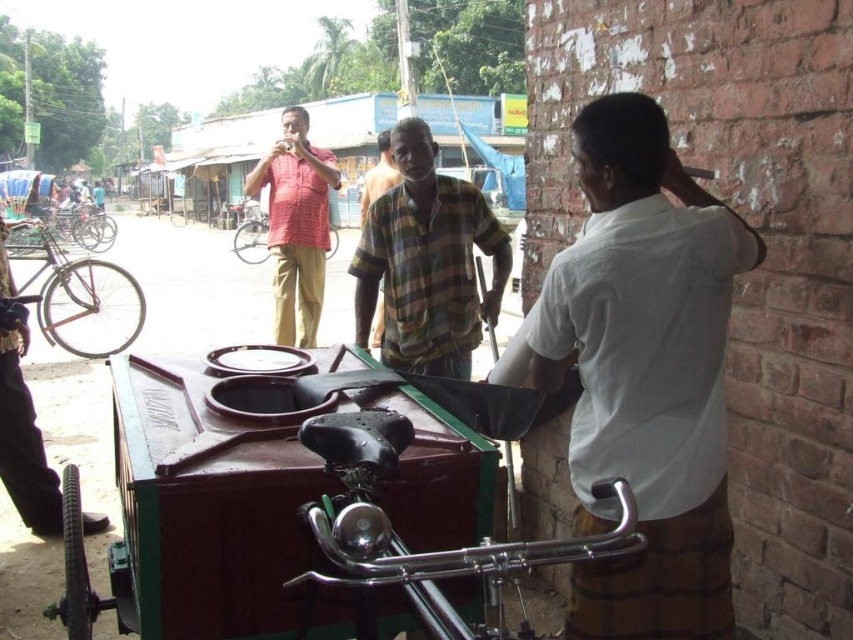
You are standing in front of the mobile food stall and want to take a photo. There are two points on the stall that you need to focus on. The first point is at coordinates point (631, 499) and the second point is at point (297, 193). Which point should you focus on first to ensure it appears larger in your photo?

Point (631, 499) is closer to the camera than point (297, 193), so focusing on point (631, 499) first will make it appear larger in the photo.

You are a delivery person who needs to pass by the wooden cart at center and the plaid cotton shirt at center. Which one do you need to avoid hitting with your delivery cart since it is wider?

The wooden cart at center is wider than the plaid cotton shirt at center, so you should avoid hitting the wooden cart at center with your delivery cart.

You are a customer waiting in line to order from the mobile food stall. You notice the wooden cart at center and the matte red shirt at center. Which object is positioned more to the right side of the scene?

The wooden cart at center is positioned to the right of the matte red shirt at center, so the wooden cart at center is more to the right side of the scene.